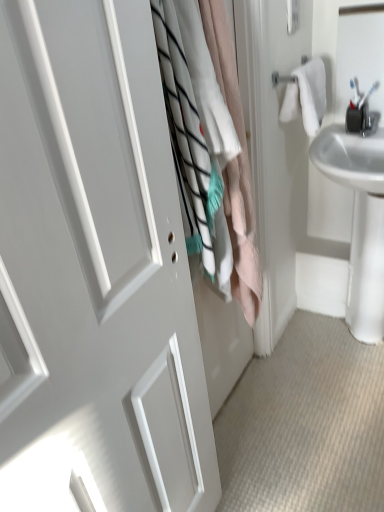
Question: Can you confirm if white glossy sink at right is bigger than white cotton laundry at center?

Choices:
 (A) no
 (B) yes

Answer: (B)

Question: Is white glossy sink at right outside white cotton laundry at center?

Choices:
 (A) no
 (B) yes

Answer: (B)

Question: Is white glossy sink at right not near white cotton laundry at center?

Choices:
 (A) no
 (B) yes

Answer: (A)

Question: From a real-world perspective, is white glossy sink at right below white cotton laundry at center?

Choices:
 (A) yes
 (B) no

Answer: (A)

Question: Considering the relative sizes of white glossy sink at right and white cotton laundry at center in the image provided, is white glossy sink at right shorter than white cotton laundry at center?

Choices:
 (A) no
 (B) yes

Answer: (B)

Question: In the image, is white cotton laundry at center on the left side or the right side of white cotton bath towel at upper right?

Choices:
 (A) left
 (B) right

Answer: (A)

Question: Considering the positions of white cotton laundry at center and white cotton bath towel at upper right in the image, is white cotton laundry at center taller or shorter than white cotton bath towel at upper right?

Choices:
 (A) short
 (B) tall

Answer: (B)

Question: From a real-world perspective, is white cotton laundry at center physically located above or below white cotton bath towel at upper right?

Choices:
 (A) above
 (B) below

Answer: (B)

Question: Looking at their shapes, would you say white cotton laundry at center is wider or thinner than white cotton bath towel at upper right?

Choices:
 (A) thin
 (B) wide

Answer: (B)

Question: Is point (365, 307) closer or farther from the camera than point (26, 432)?

Choices:
 (A) farther
 (B) closer

Answer: (A)

Question: From their relative heights in the image, would you say white glossy sink at right is taller or shorter than white matte door at center?

Choices:
 (A) short
 (B) tall

Answer: (A)

Question: Considering their positions, is white glossy sink at right located in front of or behind white matte door at center?

Choices:
 (A) front
 (B) behind

Answer: (B)

Question: From the image's perspective, relative to white matte door at center, is white glossy sink at right above or below?

Choices:
 (A) below
 (B) above

Answer: (B)

Question: From the image's perspective, is white cotton laundry at center above or below white glossy sink at right?

Choices:
 (A) above
 (B) below

Answer: (A)

Question: In the image, is white cotton laundry at center on the left side or the right side of white glossy sink at right?

Choices:
 (A) right
 (B) left

Answer: (B)